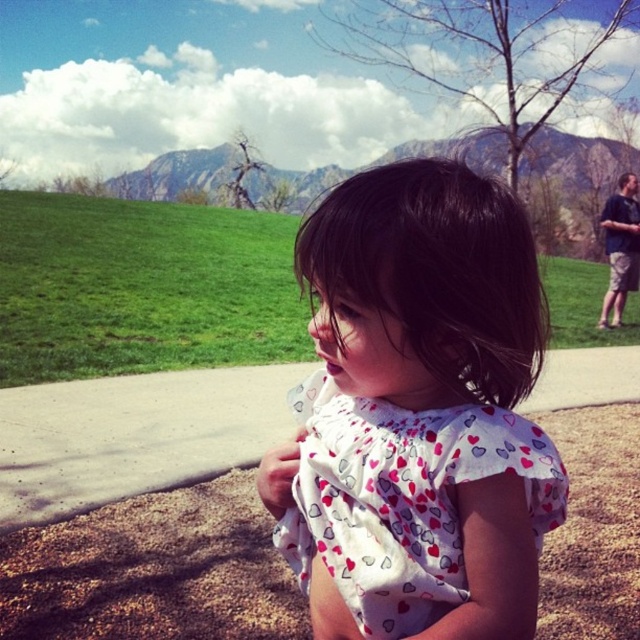
This screenshot has width=640, height=640. Describe the element at coordinates (403, 499) in the screenshot. I see `white heart-patterned fabric at center` at that location.

Locate an element on the screen. This screenshot has height=640, width=640. white heart-patterned fabric at center is located at coordinates (403, 499).

Based on the photo, which is above, white heart-patterned fabric at center or dark brown silky hair at center?

A: dark brown silky hair at center is higher up.

The width and height of the screenshot is (640, 640). I want to click on white heart-patterned fabric at center, so click(403, 499).

Does dark brown silky hair at center appear on the left side of gray concrete pavement at center?

No, dark brown silky hair at center is not to the left of gray concrete pavement at center.

Which is below, dark brown silky hair at center or gray concrete pavement at center?

gray concrete pavement at center is lower down.

Which is in front, point (413, 228) or point (161, 435)?

Point (413, 228) is more forward.

Where is `dark brown silky hair at center`? This screenshot has width=640, height=640. dark brown silky hair at center is located at coordinates (435, 273).